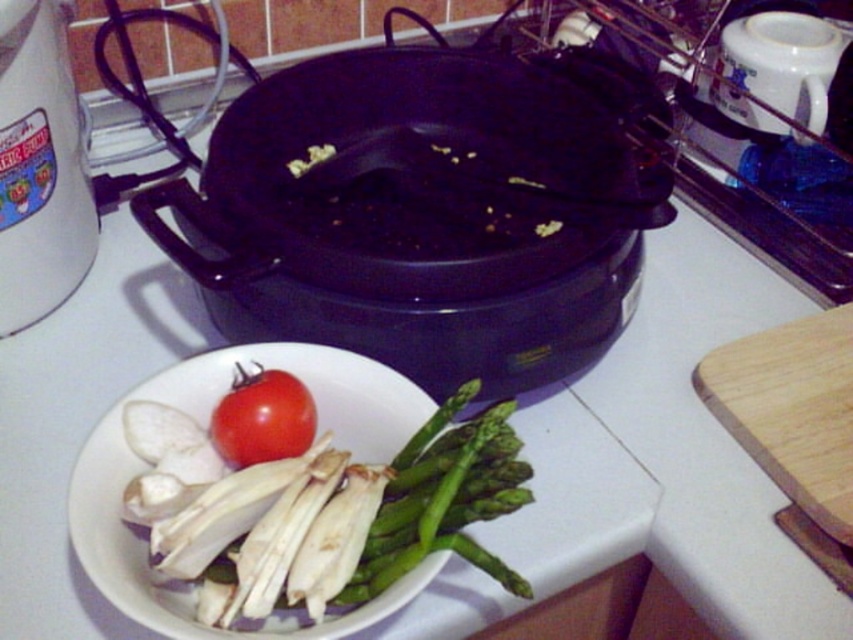
You are holding a measuring tape and need to determine the distance between the point at coordinates (x=294, y=248) and the camera. Can you calculate this distance using the provided information?

The distance between the point at coordinates (x=294, y=248) and the camera is 20.44 inches.

You are a chef standing in front of the kitchen scene described. You need to place a 15.00 inch long wooden spoon into the white glossy bowl at lower left. Can you reach it without moving your position?

The white glossy bowl at lower left is 14.90 inches from the camera, so the 15.00 inch long wooden spoon can just barely reach it. However, since the spoon is slightly longer than the distance, you might need to adjust your grip or angle to place it into the bowl.

You are a delivery robot that needs to place a package on the countertop in the kitchen scene. The package is 10 inches wide and must be placed at the exact location of the point labeled as point [309,364]. However, there is a white plate with vegetables already on the countertop. Can you safely place the package there without disturbing the plate?

The point [309,364] is 20.37 inches away from the viewer. Since the package is only 10 inches wide, it can be placed at that location as long as there is enough space on the countertop. However, the white plate with vegetables is already present there, so placing the package might displace the plate. The distance from the viewer does not indicate the available space, so further information is needed to determine if the package can be placed safely without disturbing the plate.